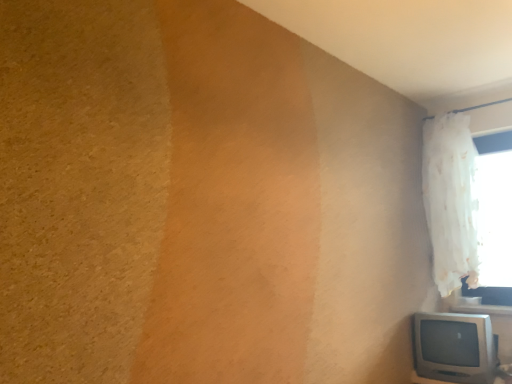
Question: Are matte silver television at lower right and white sheer curtain at upper right beside each other?

Choices:
 (A) no
 (B) yes

Answer: (A)

Question: Is matte silver television at lower right shorter than white sheer curtain at upper right?

Choices:
 (A) yes
 (B) no

Answer: (A)

Question: Considering the relative sizes of matte silver television at lower right and white sheer curtain at upper right in the image provided, is matte silver television at lower right taller than white sheer curtain at upper right?

Choices:
 (A) yes
 (B) no

Answer: (B)

Question: Is matte silver television at lower right smaller than white sheer curtain at upper right?

Choices:
 (A) yes
 (B) no

Answer: (A)

Question: From a real-world perspective, does matte silver television at lower right sit lower than white sheer curtain at upper right?

Choices:
 (A) no
 (B) yes

Answer: (B)

Question: Is matte silver television at lower right positioned far away from white sheer curtain at upper right?

Choices:
 (A) no
 (B) yes

Answer: (A)

Question: Is white sheer curtain at upper right completely or partially outside of matte silver television at lower right?

Choices:
 (A) yes
 (B) no

Answer: (A)

Question: Is white sheer curtain at upper right looking in the opposite direction of matte silver television at lower right?

Choices:
 (A) yes
 (B) no

Answer: (B)

Question: Is white sheer curtain at upper right at the left side of matte silver television at lower right?

Choices:
 (A) yes
 (B) no

Answer: (B)

Question: From a real-world perspective, is white sheer curtain at upper right below matte silver television at lower right?

Choices:
 (A) yes
 (B) no

Answer: (B)

Question: Is white sheer curtain at upper right taller than matte silver television at lower right?

Choices:
 (A) no
 (B) yes

Answer: (B)

Question: Is white sheer curtain at upper right wider than matte silver television at lower right?

Choices:
 (A) yes
 (B) no

Answer: (B)

Question: Considering the positions of white sheer curtain at upper right and matte silver television at lower right in the image, is white sheer curtain at upper right wider or thinner than matte silver television at lower right?

Choices:
 (A) thin
 (B) wide

Answer: (A)